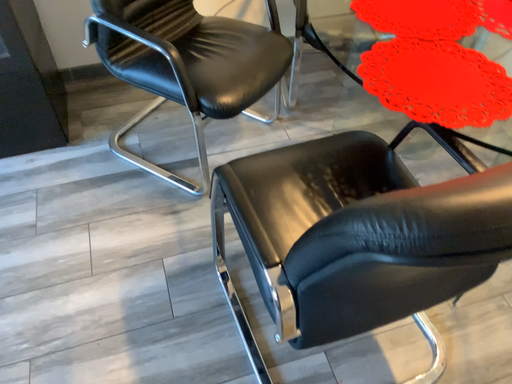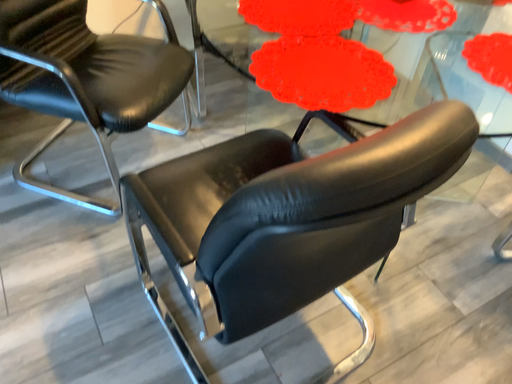
Question: Which way did the camera rotate in the video?

Choices:
 (A) rotated right
 (B) rotated left

Answer: (A)